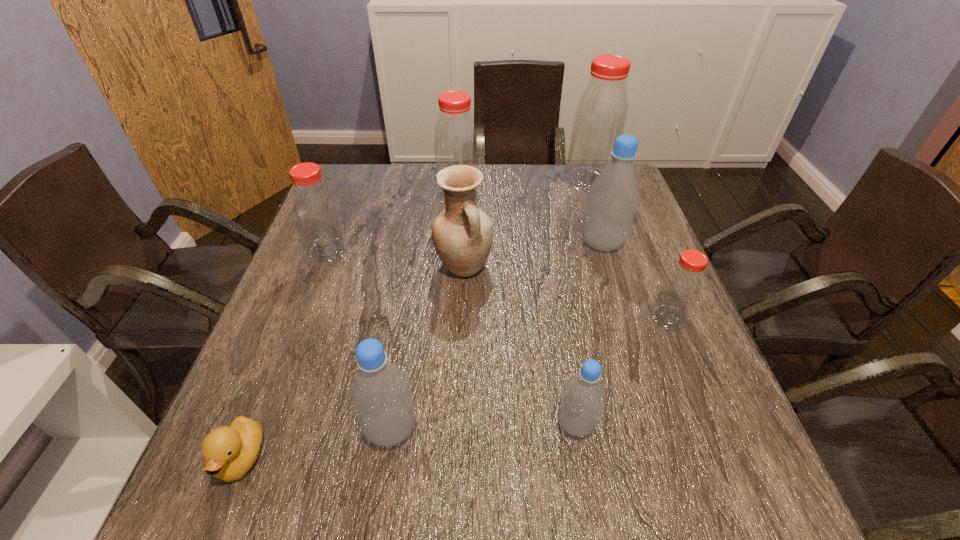
I want to click on bottle identified as the third closest to the duckling, so click(583, 399).

The image size is (960, 540). What are the coordinates of `red bottle identified as the second closest to the pottery` in the screenshot? It's located at (316, 211).

Find the location of a particular element. This screenshot has height=540, width=960. the second closest red bottle relative to the fourth bottle from left to right is located at coordinates (316, 211).

Locate an element on the screen. Image resolution: width=960 pixels, height=540 pixels. gray bottle object that ranks as the third closest to the shortest object is located at coordinates (613, 197).

Identify which gray bottle is located as the second nearest to the third smallest red bottle. Please provide its 2D coordinates. Your answer should be formatted as a tuple, i.e. [(x, y)], where the tuple contains the x and y coordinates of a point satisfying the conditions above.

[(381, 397)]

Find the location of a particular element. free point that satisfies the following two spatial constraints: 1. on the front side of the smallest red bottle; 2. on the left side of the third red bottle from right to left is located at coordinates (450, 318).